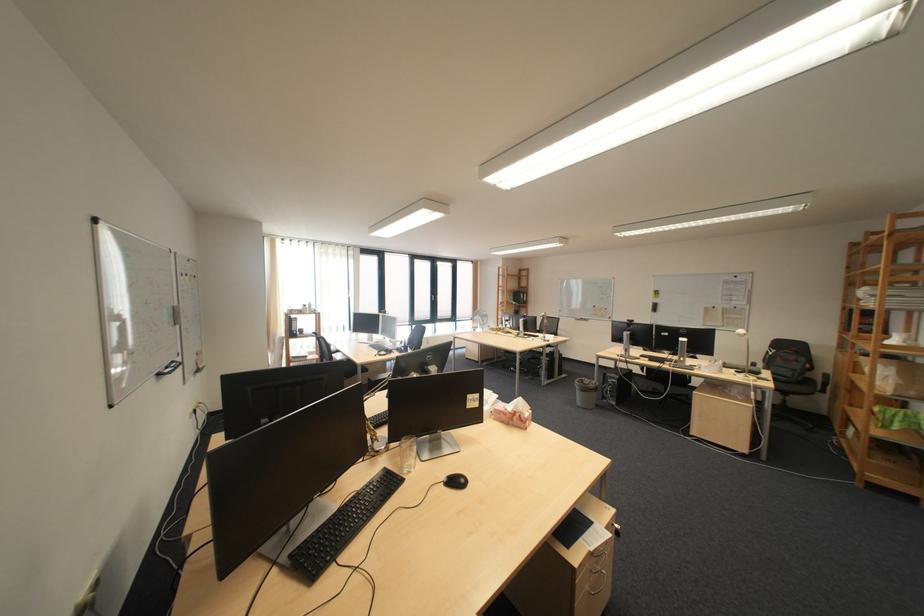
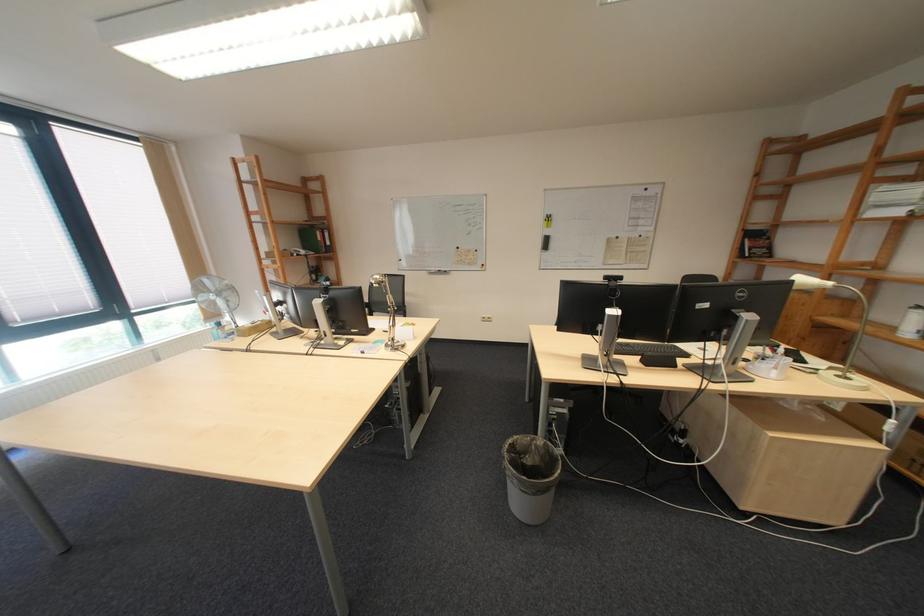
Locate, in the second image, the point that corresponds to point (599, 379) in the first image.

(529, 439)